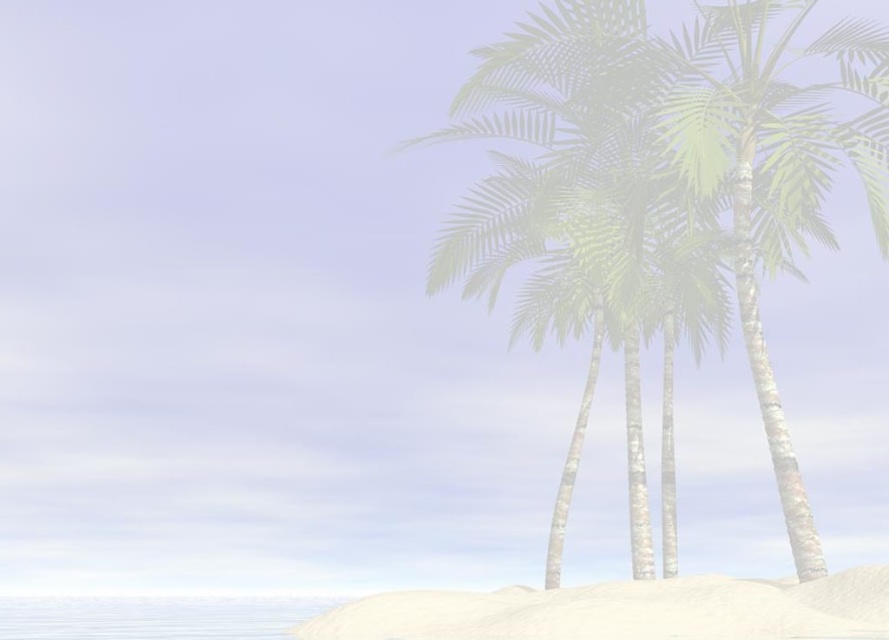
Question: Is green leafy palm tree at right below white sandy beach at lower center?

Choices:
 (A) yes
 (B) no

Answer: (B)

Question: Can you confirm if green leafy palm tree at right is wider than white sandy beach at lower center?

Choices:
 (A) no
 (B) yes

Answer: (A)

Question: Can you confirm if green leafy palm tree at right is positioned to the right of white sandy beach at lower center?

Choices:
 (A) no
 (B) yes

Answer: (B)

Question: Which point is closer to the camera taking this photo?

Choices:
 (A) (791, 225)
 (B) (685, 593)

Answer: (B)